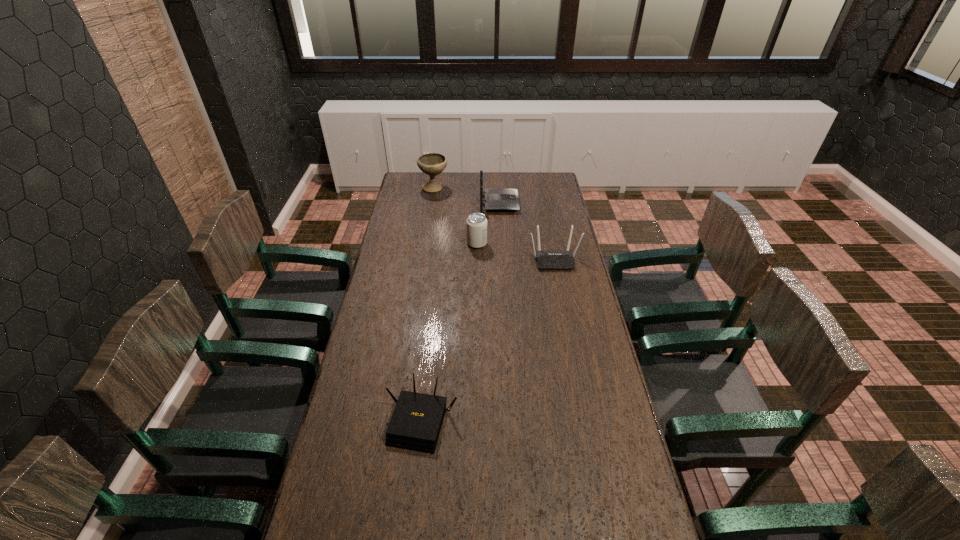
You are a GUI agent. You are given a task and a screenshot of the screen. Output one action in this format:
    pyautogui.click(x=<x>, y=<y>)
    Task: Click on the router that is the closest one to the chalice
    
    Given the screenshot: What is the action you would take?
    pyautogui.click(x=496, y=199)

Locate an element on the screen. The width and height of the screenshot is (960, 540). router that is the second closest to the farthest router is located at coordinates (415, 425).